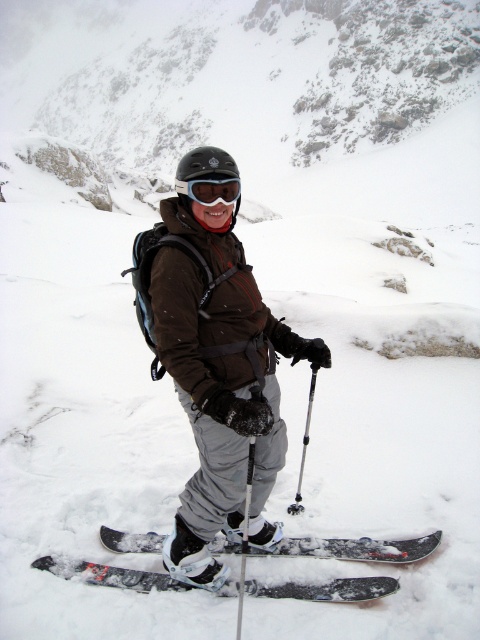
You are a rescue team member who needs to assess the distance between the brown matte jacket at center and the black matte skis at center in the image. The minimum safe distance for a rescue drone to hover between them is 24 inches. Can the drone safely hover between them?

The distance between the brown matte jacket at center and the black matte skis at center is 24.33 inches, which is just over the minimum safe distance of 24 inches. Therefore, the rescue drone can safely hover between them.

You are planning to take a photo of the brown matte jacket at center and the silver metallic ski pole at center from above. Which object will appear larger in the photo?

The brown matte jacket at center is taller than the silver metallic ski pole at center, so it will appear larger in the photo.